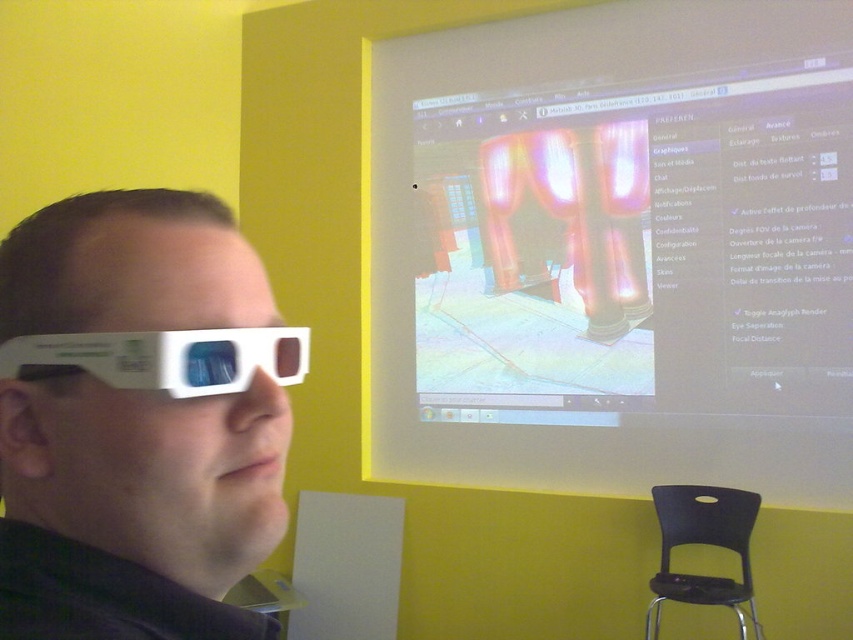
Consider the image. You are organizing a small event and need to arrange seating for guests. You have a limited space and want to place the white plastic 3d glasses at left and the black plastic chair at lower right. Which object takes up more space and should be placed first to optimize space?

The black plastic chair at lower right takes up more space than the white plastic 3d glasses at left, so it should be placed first to optimize space.

You are a photographer adjusting your camera to focus on two points in the scene. The points are labeled as point (779, 48) and point (33, 365). Since you can only focus on one point at a time, which point should you choose to ensure the other point remains in focus if the depth of field is sufficient?

To ensure both points are in focus, you should focus on the point that is at the midpoint between them. However, since you can only focus on one point, you need to choose the point that is closer to the camera. Point (779, 48) is further away than point (33, 365). Therefore, focusing on point (33, 365) increases the likelihood that the other point will be within the depth of field.

You are looking at the 3D display and see two points on the screen. The first point is at coordinates point (264,356) and the second is at point (706,532). Which point is closer to your eyes?

Point (264,356) is closer to the camera than point (706,532), so the first point is closer to your eyes.